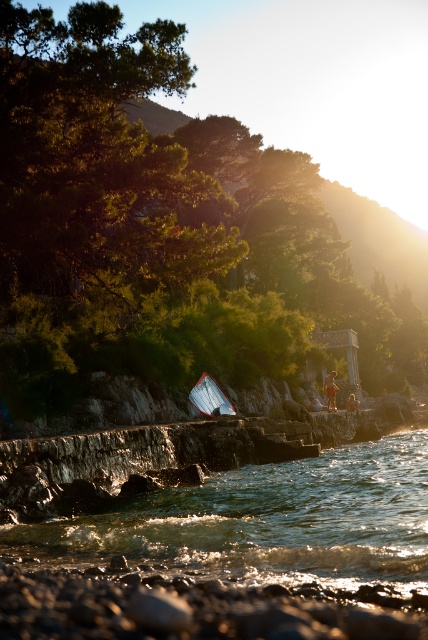
Based on the photo, is clear water at lower center taller than white plastic boat at center?

Correct, clear water at lower center is much taller as white plastic boat at center.

Describe the element at coordinates (264, 522) in the screenshot. The width and height of the screenshot is (428, 640). I see `clear water at lower center` at that location.

Which is in front, point (413, 456) or point (208, 374)?

Positioned in front is point (413, 456).

Where is `clear water at lower center`? The image size is (428, 640). clear water at lower center is located at coordinates (264, 522).

Who is positioned more to the left, smooth pebbles at lower center or white plastic boat at center?

white plastic boat at center

Is the position of smooth pebbles at lower center less distant than that of white plastic boat at center?

Yes, smooth pebbles at lower center is in front of white plastic boat at center.

Describe the element at coordinates (195, 609) in the screenshot. The image size is (428, 640). I see `smooth pebbles at lower center` at that location.

Where is `smooth pebbles at lower center`? The width and height of the screenshot is (428, 640). smooth pebbles at lower center is located at coordinates (195, 609).

Is point (211, 390) closer to camera compared to point (332, 387)?

Yes, it is in front of point (332, 387).

Is white plastic boat at center below tan fabric shorts at lower right?

Actually, white plastic boat at center is above tan fabric shorts at lower right.

What do you see at coordinates (210, 397) in the screenshot? This screenshot has height=640, width=428. I see `white plastic boat at center` at bounding box center [210, 397].

I want to click on white plastic boat at center, so click(x=210, y=397).